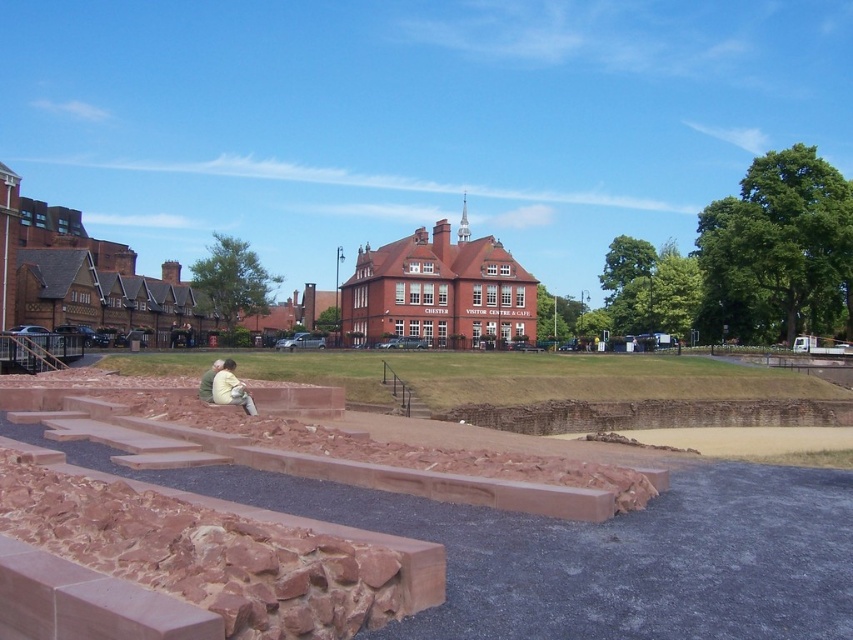
Question: Considering the relative positions of light beige fabric at center and green fabric jacket at lower left in the image provided, where is light beige fabric at center located with respect to green fabric jacket at lower left?

Choices:
 (A) above
 (B) below

Answer: (B)

Question: Which object is closer to the camera taking this photo?

Choices:
 (A) light beige fabric at center
 (B) green fabric jacket at lower left

Answer: (A)

Question: Among these points, which one is farthest from the camera?

Choices:
 (A) (218, 371)
 (B) (630, 589)
 (C) (225, 369)

Answer: (C)

Question: Which of the following is the farthest from the observer?

Choices:
 (A) (508, 356)
 (B) (206, 396)
 (C) (223, 380)

Answer: (A)

Question: Can you confirm if light beige fabric at center is thinner than green fabric jacket at lower left?

Choices:
 (A) yes
 (B) no

Answer: (A)

Question: Where is light beige fabric at center located in relation to green fabric jacket at lower left in the image?

Choices:
 (A) right
 (B) left

Answer: (A)